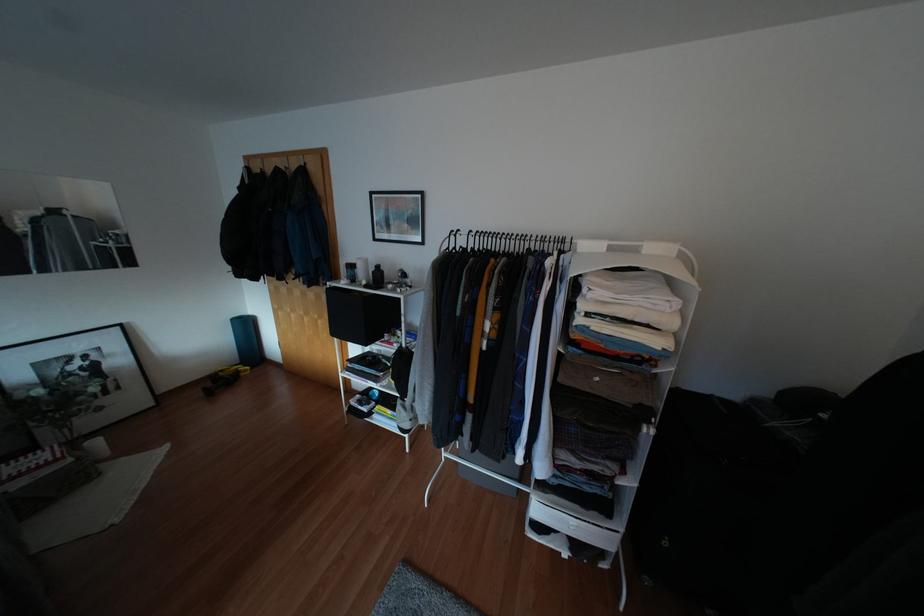
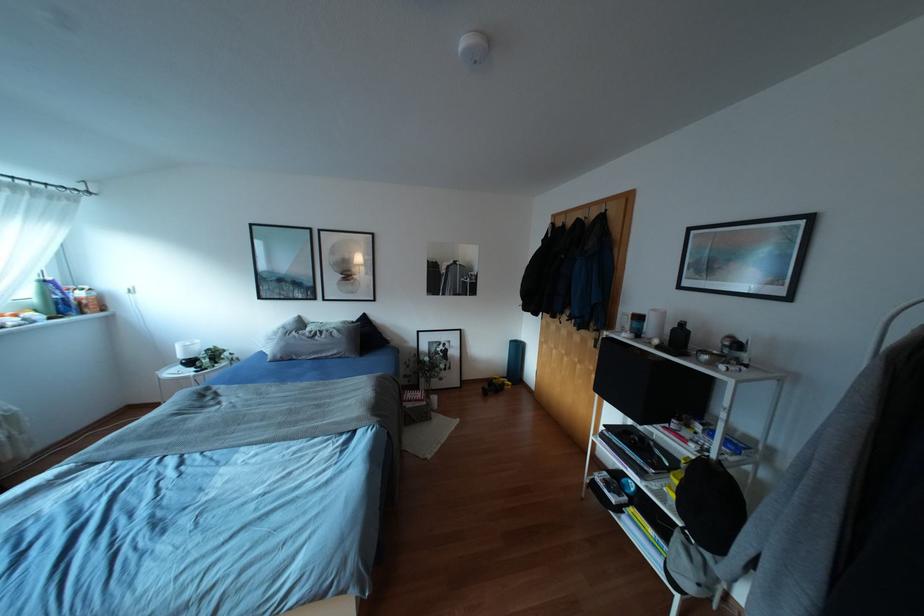
The point at (377,265) is marked in the first image. Where is the corresponding point in the second image?

(682, 323)